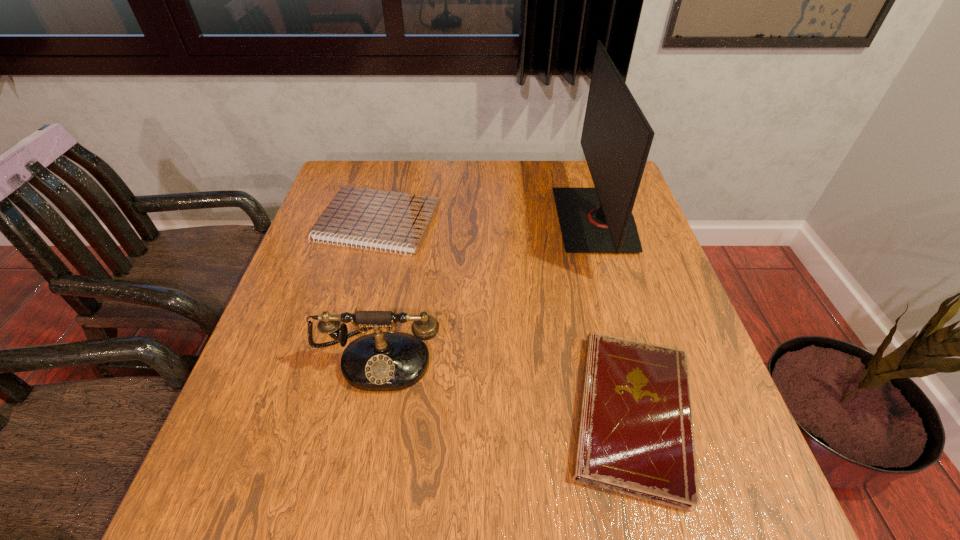
The height and width of the screenshot is (540, 960). I want to click on monitor located in the far edge section of the desktop, so click(616, 138).

I want to click on notebook that is at the far edge, so click(x=387, y=220).

Locate an element on the screen. object situated at the near edge is located at coordinates pos(635,437).

This screenshot has height=540, width=960. I want to click on telephone positioned at the left edge, so click(x=381, y=361).

Identify the location of notebook located at the left edge. The height and width of the screenshot is (540, 960). (387, 220).

The height and width of the screenshot is (540, 960). I want to click on monitor that is at the right edge, so click(616, 138).

The height and width of the screenshot is (540, 960). Find the location of `notebook present at the right edge`. notebook present at the right edge is located at coordinates (635, 437).

Identify the location of object situated at the far left corner. (387, 220).

This screenshot has width=960, height=540. I want to click on object located at the far right corner, so click(616, 138).

Locate an element on the screen. object that is at the near right corner is located at coordinates (635, 437).